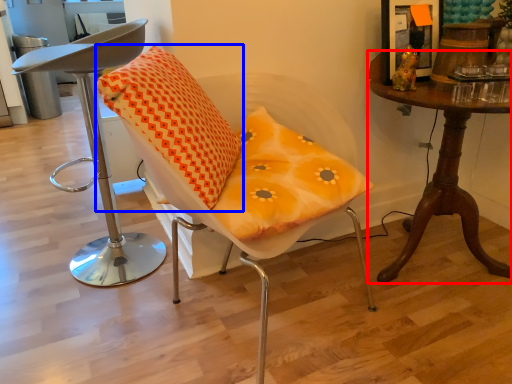
Question: Which object appears closest to the camera in this image, table (highlighted by a red box) or pillow (highlighted by a blue box)?

Choices:
 (A) table
 (B) pillow

Answer: (B)